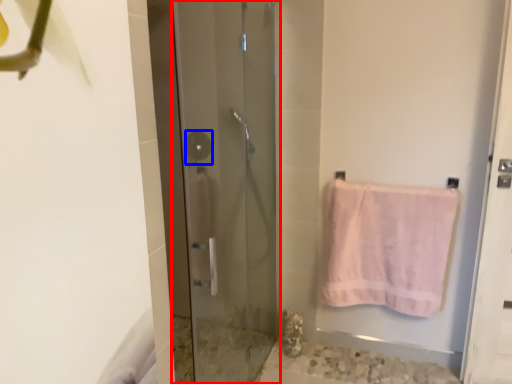
Question: Which object appears farthest to the camera in this image, door (highlighted by a red box) or shower (highlighted by a blue box)?

Choices:
 (A) door
 (B) shower

Answer: (B)